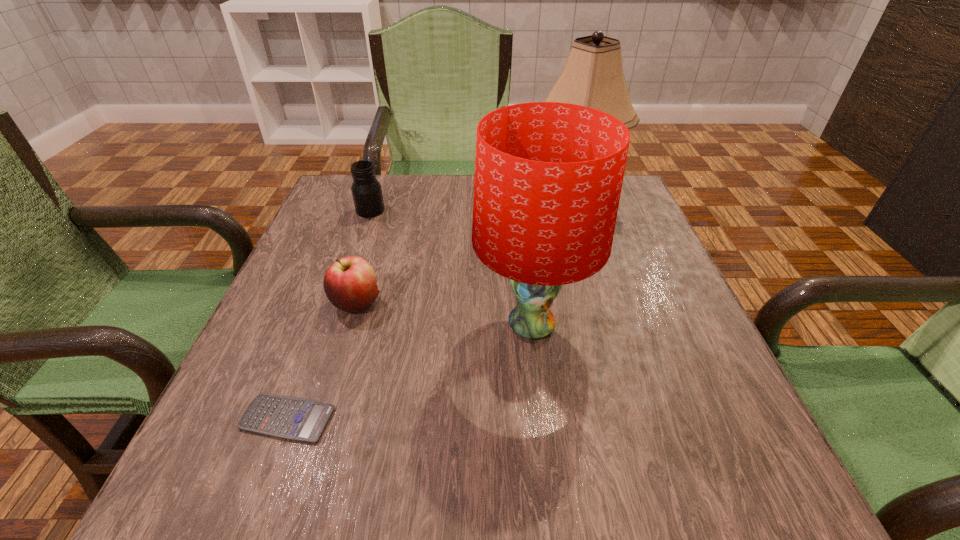
Locate an element on the screen. Image resolution: width=960 pixels, height=540 pixels. object positioned at the far right corner is located at coordinates (592, 76).

Where is `vacant space at the far edge of the desktop`? This screenshot has width=960, height=540. vacant space at the far edge of the desktop is located at coordinates (468, 197).

In the image, there is a desktop. In order to click on vacant space at the near edge in this screenshot , I will do `click(466, 475)`.

The image size is (960, 540). I want to click on free region at the left edge, so click(284, 361).

Image resolution: width=960 pixels, height=540 pixels. I want to click on free space at the right edge, so pyautogui.click(x=659, y=442).

Locate an element on the screen. This screenshot has height=540, width=960. vacant space at the near left corner of the desktop is located at coordinates (282, 447).

Identify the location of free space between the third shortest object and the lampshade. (451, 268).

Where is `free space between the lamp and the shortest object`? free space between the lamp and the shortest object is located at coordinates (430, 311).

Where is `empty space between the lampshade and the shortest object`? The width and height of the screenshot is (960, 540). empty space between the lampshade and the shortest object is located at coordinates (410, 372).

This screenshot has width=960, height=540. Identify the location of vacant area that lies between the shortest object and the apple. (323, 361).